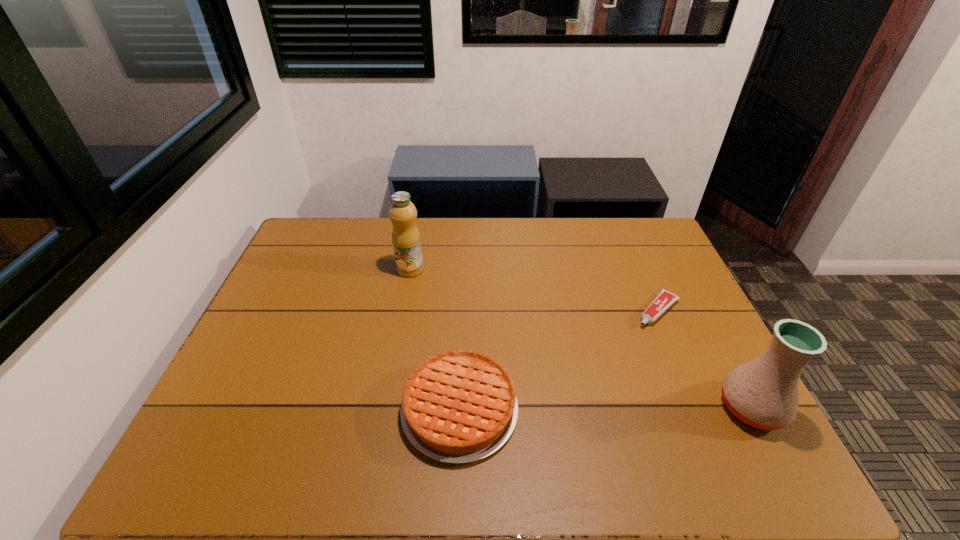
At what (x,y) coordinates should I click in order to perform the action: click on free space between the second shortest object and the pottery. Please return your answer as a coordinate pair (x, y). Image resolution: width=960 pixels, height=540 pixels. Looking at the image, I should click on (606, 408).

Find the location of `free space that is in between the third tallest object and the pottery`. free space that is in between the third tallest object and the pottery is located at coordinates (606, 408).

I want to click on free space between the pottery and the farthest object, so click(x=581, y=339).

Where is `the third closest object relative to the pottery`? the third closest object relative to the pottery is located at coordinates (406, 239).

Locate an element on the screen. The width and height of the screenshot is (960, 540). the second closest object to the pie is located at coordinates (665, 299).

Locate an element on the screen. The image size is (960, 540). free spot that satisfies the following two spatial constraints: 1. on the front side of the pottery; 2. on the right side of the fruit juice is located at coordinates (385, 407).

Image resolution: width=960 pixels, height=540 pixels. In order to click on free space that satisfies the following two spatial constraints: 1. on the front side of the second farthest object; 2. on the left side of the farthest object in this screenshot , I will do `click(403, 310)`.

You are a GUI agent. You are given a task and a screenshot of the screen. Output one action in this format:
    pyautogui.click(x=<x>, y=<y>)
    Task: Click on the vacant region that satisfies the following two spatial constraints: 1. on the front side of the toothpaste; 2. on the right side of the farthest object
    The height and width of the screenshot is (540, 960).
    Given the screenshot: What is the action you would take?
    pyautogui.click(x=403, y=310)

Find the location of a particular element. The width and height of the screenshot is (960, 540). vacant area that satisfies the following two spatial constraints: 1. on the front side of the farthest object; 2. on the left side of the toothpaste is located at coordinates (403, 310).